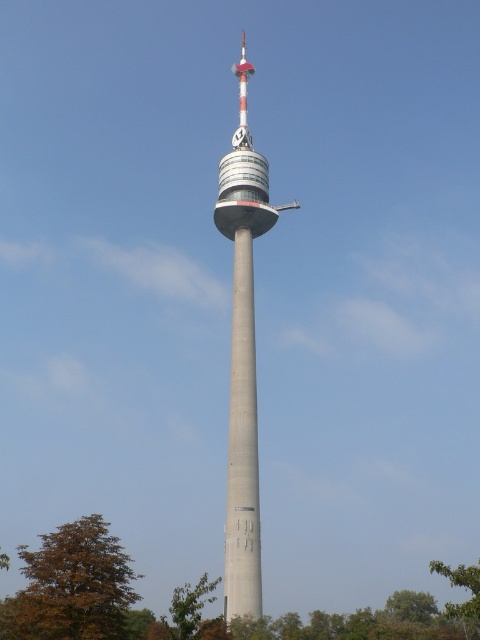
You are standing at a certain distance from the concrete tower at center. If you want to take a photo that captures the entire tower without cropping any part of it, what is the minimum distance you should maintain from the tower?

To capture the entire concrete tower at center in a photo without cropping, you should maintain a minimum distance of 92.21 meters from the tower, as this is the distance between the viewer and the tower.

You are standing at the base of the tall tower and want to take a photo of the brown leafy tree at lower left. If your camera can focus on objects up to 70 meters away, will it be able to capture the tree clearly?

The brown leafy tree at lower left is 67.24 meters away from the camera. Since the camera can focus up to 70 meters, it will be able to capture the tree clearly.

You are standing at the base of the concrete tower at center. Looking up, you notice a point marked at coordinates point [242,355]. Where would this point be located on the tower?

The point [242,355] is located at the center of the concrete tower at center, as it is represented by that coordinate.